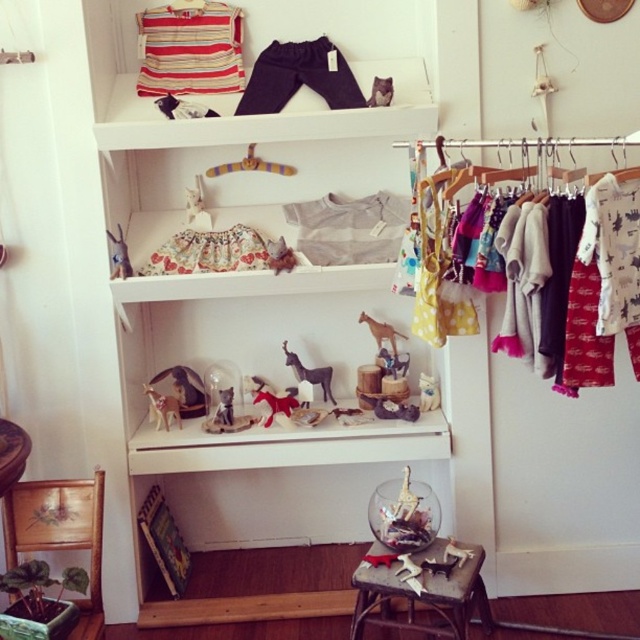
Is floral cotton skirt at center thinner than fluffy fabric dress at center?

Incorrect, floral cotton skirt at center's width is not less than fluffy fabric dress at center's.

Which is below, floral cotton skirt at center or fluffy fabric dress at center?

fluffy fabric dress at center

Is point (186, 257) closer to viewer compared to point (289, 253)?

No.

Image resolution: width=640 pixels, height=640 pixels. I want to click on floral cotton skirt at center, so click(208, 252).

Can you confirm if floral cotton skirt at center is positioned above velvet plush horse at center?

Indeed, floral cotton skirt at center is positioned over velvet plush horse at center.

Does floral cotton skirt at center appear under velvet plush horse at center?

No.

This screenshot has width=640, height=640. What do you see at coordinates (208, 252) in the screenshot?
I see `floral cotton skirt at center` at bounding box center [208, 252].

The image size is (640, 640). In order to click on floral cotton skirt at center in this screenshot , I will do 208,252.

Between striped cotton shirt at upper left and wooden toy at center, which one is positioned higher?

striped cotton shirt at upper left

Locate an element on the screen. striped cotton shirt at upper left is located at coordinates (189, 49).

Who is more forward, (134,88) or (225,420)?

Point (134,88) is more forward.

Where is `striped cotton shirt at upper left`? The height and width of the screenshot is (640, 640). striped cotton shirt at upper left is located at coordinates (189, 49).